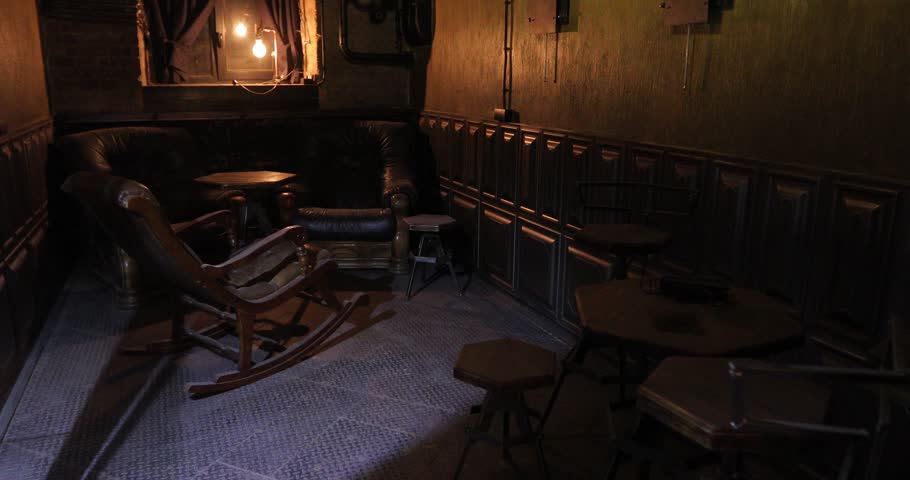
You are a GUI agent. You are given a task and a screenshot of the screen. Output one action in this format:
    pyautogui.click(x=<x>, y=<y>)
    Task: Click on the chair
    The width and height of the screenshot is (910, 480).
    Given the screenshot: What is the action you would take?
    pyautogui.click(x=194, y=270)